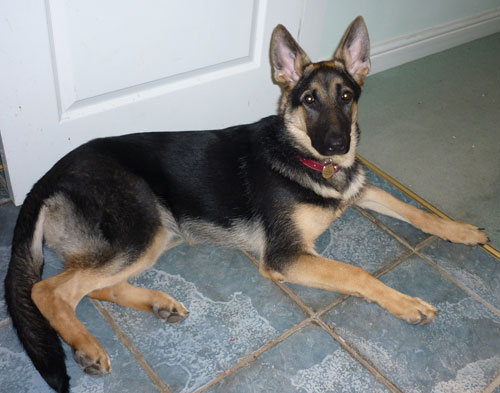
Identify the location of worn carpet. (453, 148).